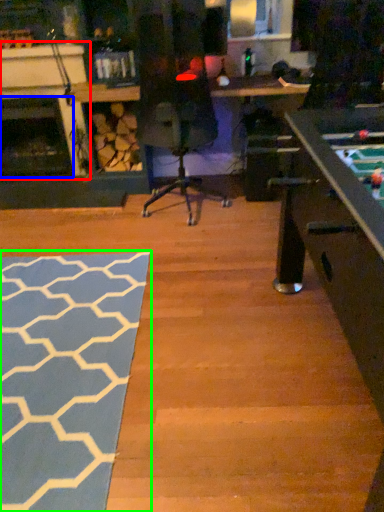
Question: Considering the real-world distances, which object is closest to fireplace (highlighted by a red box)? fireplace (highlighted by a blue box) or mat (highlighted by a green box).

Choices:
 (A) fireplace
 (B) mat

Answer: (A)